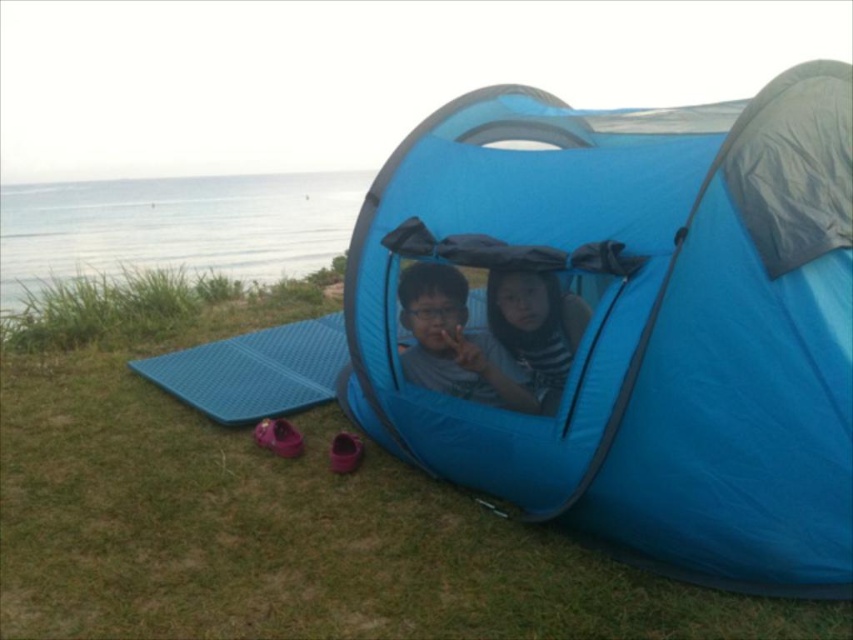
You are a hiker who has just arrived at the cliffside camping spot. You need to set up your tent exactly at the coordinates point (454, 342). However, there is already a tent there. Where should you set up your tent instead?

The matte blue tent at center is already located at point (454, 342), so you should choose a different spot away from that coordinate to set up your tent.